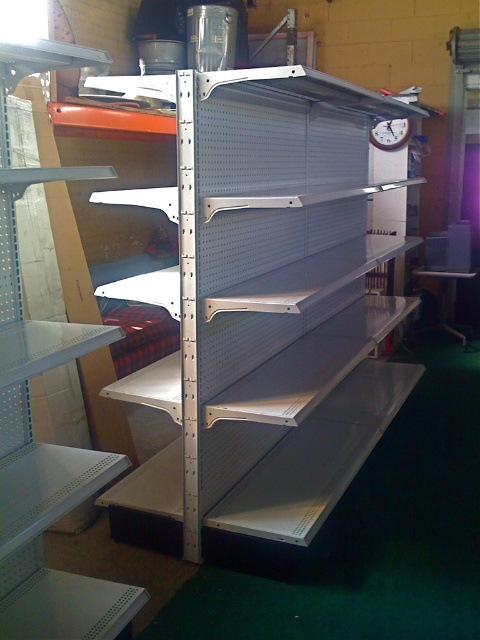
You are organizing items in a storage area and need to place a new tool on the metallic silver workbench at lower right. However, you also need to check the time on the white plastic clock at upper center. Which object is closer to you so you can reach it without moving?

The metallic silver workbench at lower right is closer to you than the white plastic clock at upper center, so you can reach it without moving.

You are an inventory manager trying to place a new white plastic clock at upper center on the metallic gray shelves at center. Given that the clock requires a space equal to its own width, will there be enough space on the shelves?

The metallic gray shelves at center are wider than the white plastic clock at upper center, so there is sufficient space to place the clock on the shelves.

You need to place a heavy tool on the metallic gray shelves at center or the metallic silver workbench at lower right. Which surface is more suitable for supporting heavy items?

The metallic gray shelves at center are above the metallic silver workbench at lower right, so the workbench is more suitable for placing heavy tools as it is likely more stable and lower to the ground.